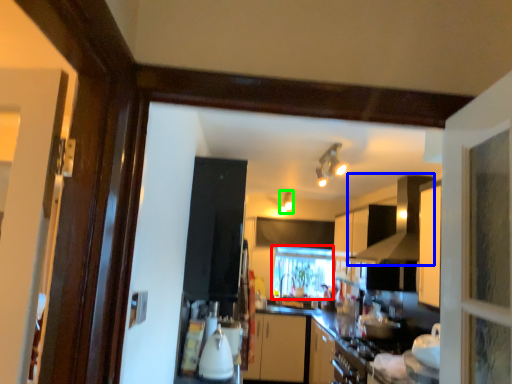
Question: Which object is the farthest from window (highlighted by a red box)? Choose among these: exhaust hood (highlighted by a blue box) or light fixture (highlighted by a green box).

Choices:
 (A) exhaust hood
 (B) light fixture

Answer: (A)